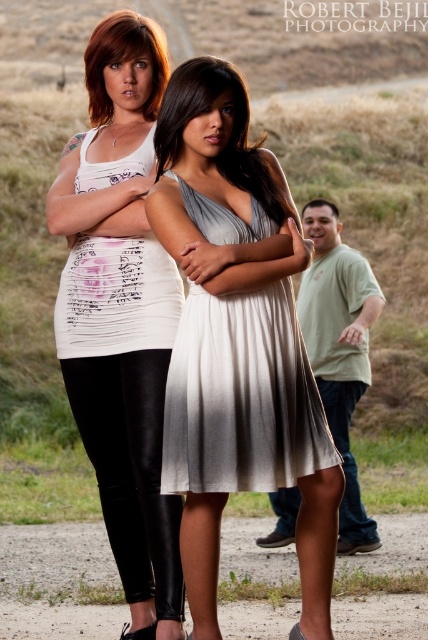
You are taking a photo of two women standing on a dirt path. The shiny brown hair at upper left and the green matte shirt at right are in the frame. Which object is positioned to the left of the other?

The shiny brown hair at upper left is to the left of green matte shirt at right.

You are a photographer setting up for a photoshoot. You need to ensure that the subject wearing the satin dress at center is fully visible without any obstruction from the white matte tank top at upper left. Based on the scene description, can you confirm if this is possible?

The satin dress at center is in front of the white matte tank top at upper left, so the subject wearing the satin dress at center will be fully visible without obstruction from the white matte tank top at upper left.

You are a photographer setting up for a group shot. You notice the silky beige dress at center and the shiny brown hair at upper left in the frame. Which object is positioned lower in the image?

The silky beige dress at center is located below shiny brown hair at upper left, so the silky beige dress at center is positioned lower in the image.